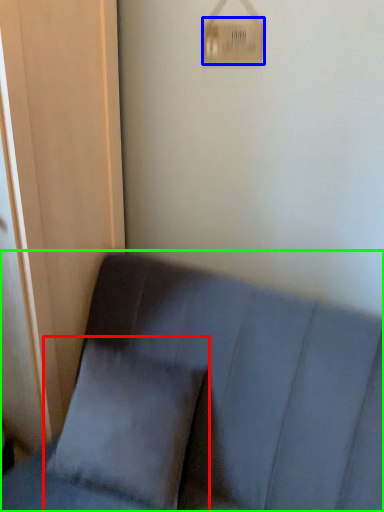
Question: Estimate the real-world distances between objects in this image. Which object is closer to pillow (highlighted by a red box), light switch (highlighted by a blue box) or furniture (highlighted by a green box)?

Choices:
 (A) light switch
 (B) furniture

Answer: (B)